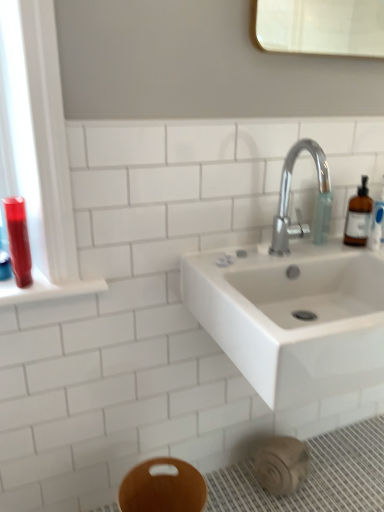
At what (x,y) coordinates should I click in order to perform the action: click on vacant space to the left of polished chrome faucet at upper right. Please return your answer as a coordinate pair (x, y). Image resolution: width=384 pixels, height=512 pixels. Looking at the image, I should click on (253, 249).